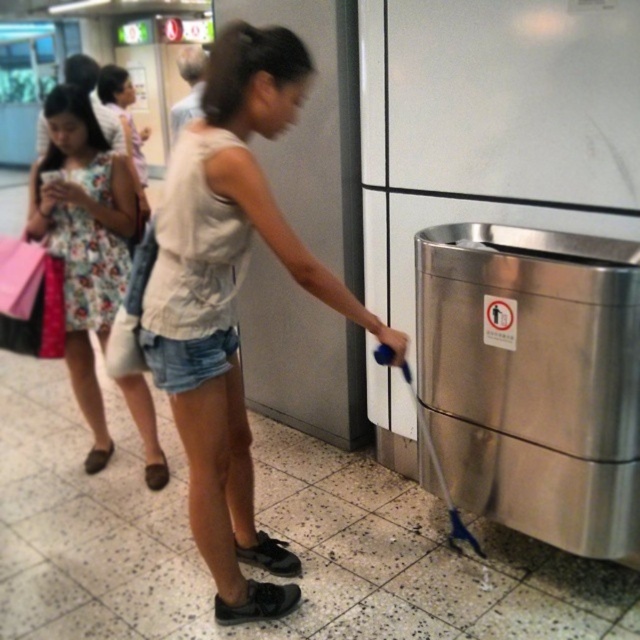
Which of these two, white cotton tank top at center or floral fabric dress at left, stands taller?

Standing taller between the two is white cotton tank top at center.

Is the position of white cotton tank top at center more distant than that of floral fabric dress at left?

No, it is in front of floral fabric dress at left.

You are a GUI agent. You are given a task and a screenshot of the screen. Output one action in this format:
    pyautogui.click(x=<x>, y=<y>)
    Task: Click on the white cotton tank top at center
    Image resolution: width=640 pixels, height=640 pixels.
    Given the screenshot: What is the action you would take?
    pyautogui.click(x=228, y=301)